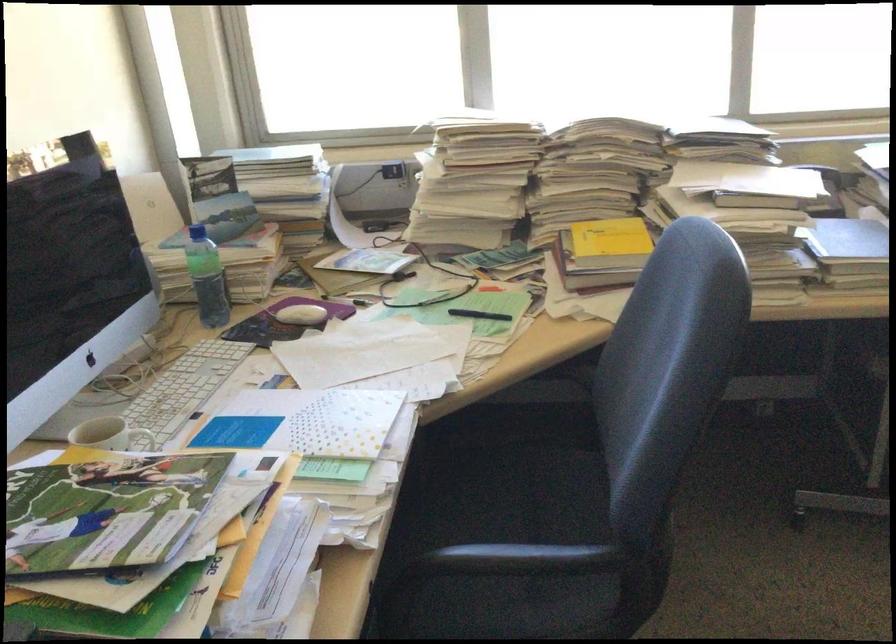
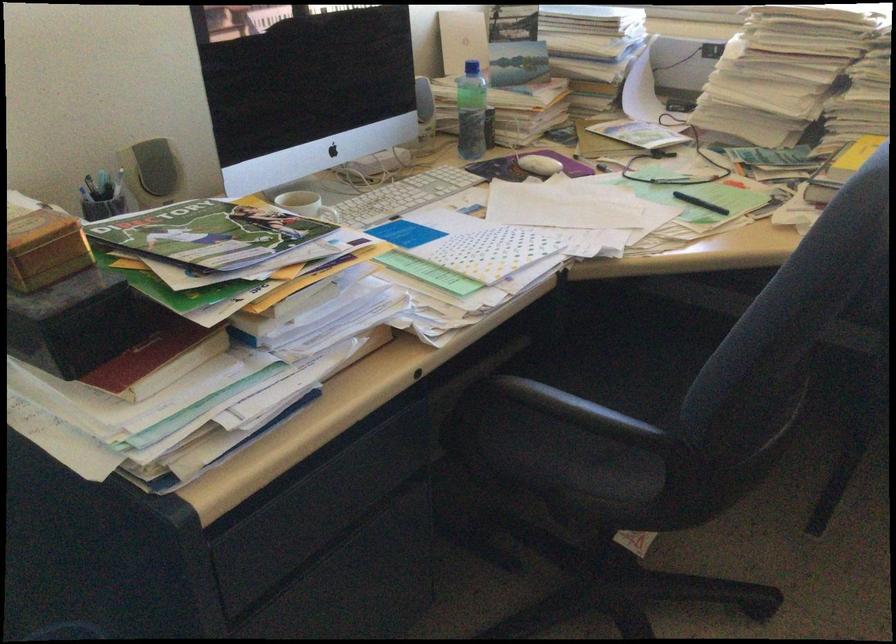
The point at (306, 317) is marked in the first image. Where is the corresponding point in the second image?

(538, 165)